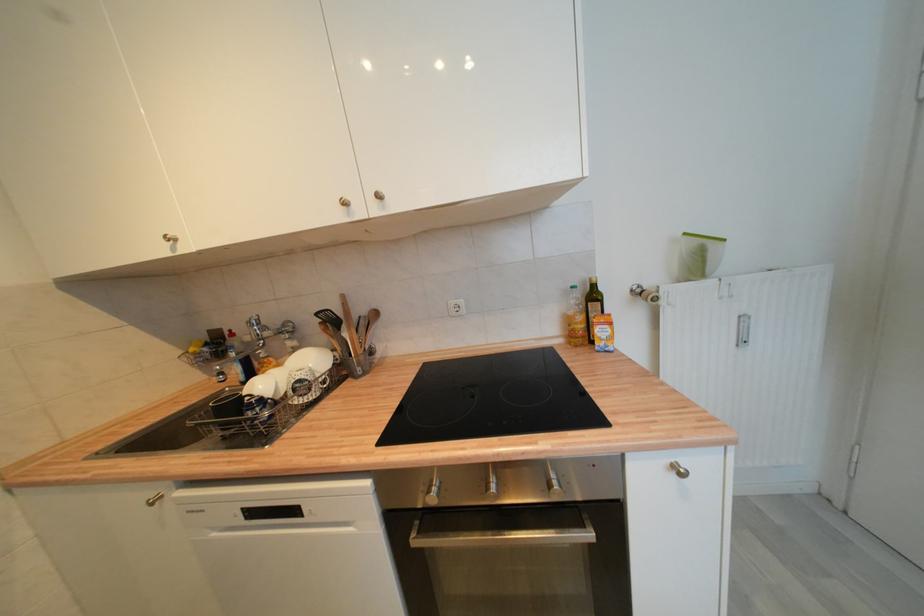
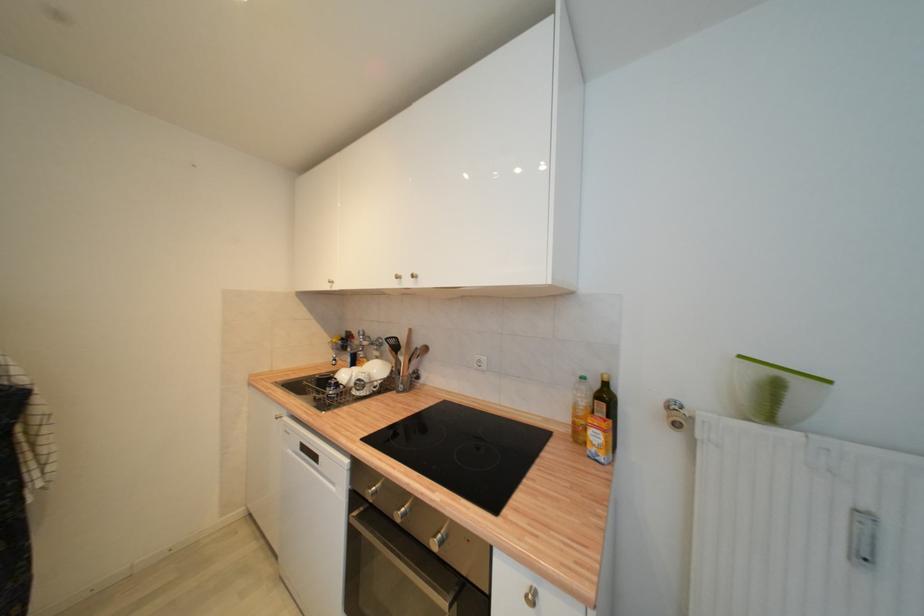
The point at (578, 289) is marked in the first image. Where is the corresponding point in the second image?

(586, 379)